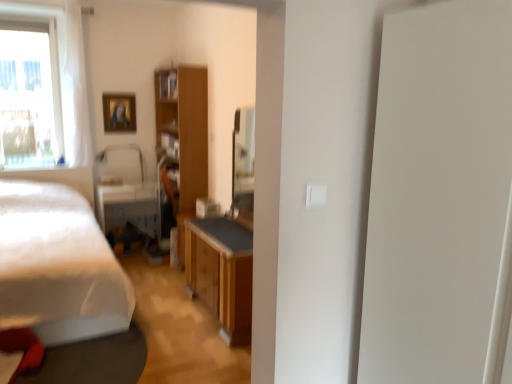
Question: From the image's perspective, is wooden cabinet at center above or below transparent glass window at upper left?

Choices:
 (A) below
 (B) above

Answer: (A)

Question: Is point (201, 188) closer or farther from the camera than point (80, 100)?

Choices:
 (A) farther
 (B) closer

Answer: (B)

Question: Which of these objects is positioned closest to the wooden picture frame at upper left?

Choices:
 (A) transparent glass window at upper left
 (B) white sheer curtain at left
 (C) matte black swivel chair at center
 (D) white matte bed at left
 (E) wooden cabinet at center

Answer: (A)

Question: Which object is the farthest from the white matte bed at left?

Choices:
 (A) transparent glass window at upper left
 (B) wooden cabinet at center
 (C) wooden picture frame at upper left
 (D) matte black swivel chair at center
 (E) white sheer curtain at left

Answer: (C)